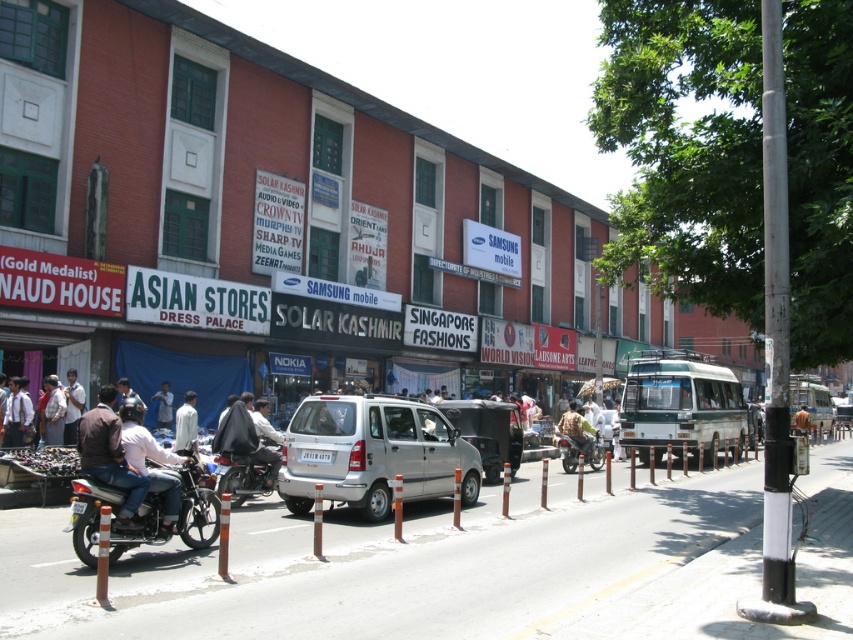
Question: Which is nearer to the white matte shirt at center?

Choices:
 (A) light blue shirt at center
 (B) matte black van at center
 (C) shiny black motorcycle at center

Answer: (C)

Question: Can you confirm if silver metallic van at center is wider than white matte shirt at center?

Choices:
 (A) yes
 (B) no

Answer: (A)

Question: Does dark brown leather jacket at lower left appear over light blue jeans at lower left?

Choices:
 (A) yes
 (B) no

Answer: (B)

Question: Does shiny black motorcycle at lower left appear over white matte shirt at center?

Choices:
 (A) yes
 (B) no

Answer: (B)

Question: Which object is the closest to the light blue shirt at center?

Choices:
 (A) light blue jeans at lower left
 (B) shiny black motorcycle at center

Answer: (B)

Question: Which object is the farthest from the light blue shirt at center?

Choices:
 (A) light blue jeans at center
 (B) silver metallic van at center
 (C) light blue jeans at lower left

Answer: (C)